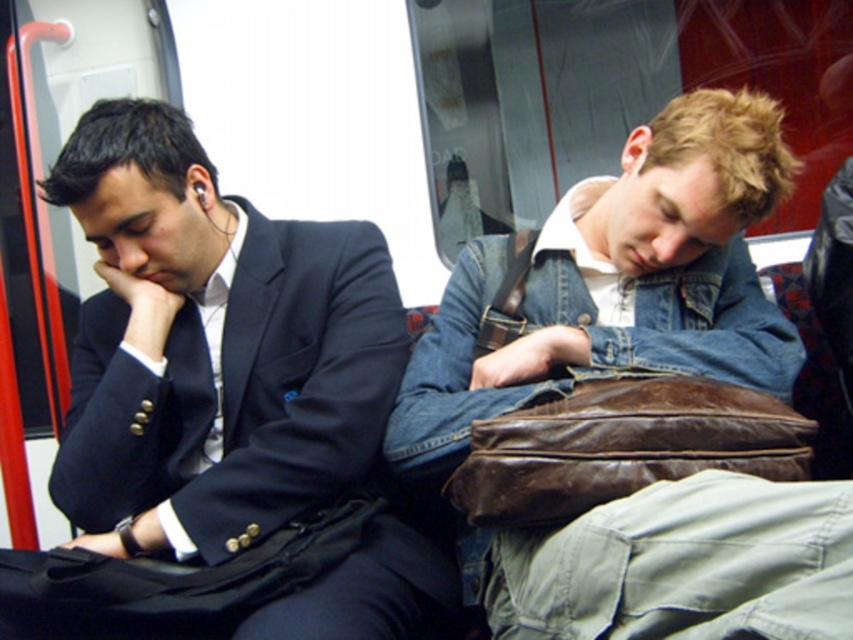
Who is lower down, matte black suit at left or denim jacket at center?

denim jacket at center

Can you confirm if matte black suit at left is thinner than denim jacket at center?

Indeed, matte black suit at left has a lesser width compared to denim jacket at center.

Find the location of `matte black suit at left`. matte black suit at left is located at coordinates (222, 417).

You are a GUI agent. You are given a task and a screenshot of the screen. Output one action in this format:
    pyautogui.click(x=<x>, y=<y>)
    Task: Click on the matte black suit at left
    This screenshot has height=640, width=853.
    Given the screenshot: What is the action you would take?
    pyautogui.click(x=222, y=417)